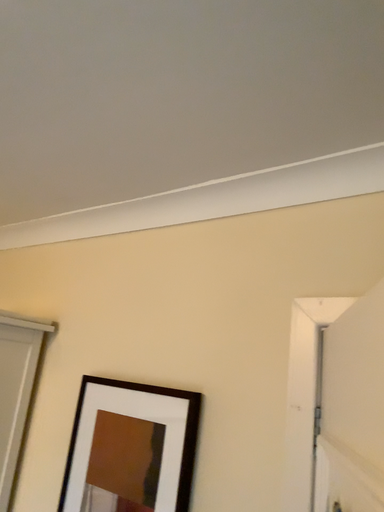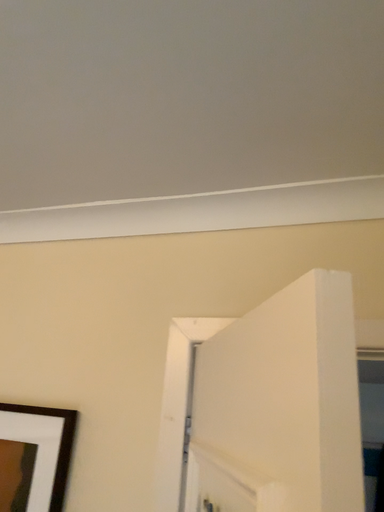
Question: Which way did the camera rotate in the video?

Choices:
 (A) rotated left
 (B) rotated right

Answer: (B)